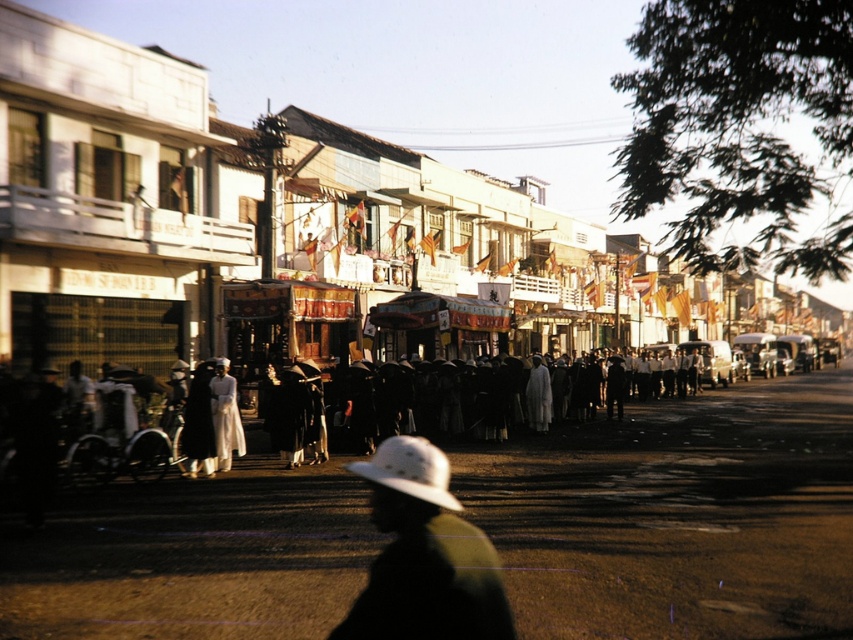
You are a photographer trying to capture a person wearing both a white felt hat at center and a white satin dress at center. The scene is a bustling street with warm golden light. To ensure both items are visible in your photo, which one should you focus on first?

The white felt hat at center is located below the white satin dress at center, so you should focus on the white satin dress at center first to ensure both are in frame.

You are standing at the camera position looking at the scene. Where is the white felt hat at center located in terms of coordinates?

The white felt hat at center is located at coordinates point (424, 556).

You are a photographer trying to capture both the white felt hat at center and the white satin dress at center in a single shot. However, you notice that one is blocking the other. Which object is currently obscuring the other?

The white felt hat at center is in front of the white satin dress at center, so it is obscuring the dress.